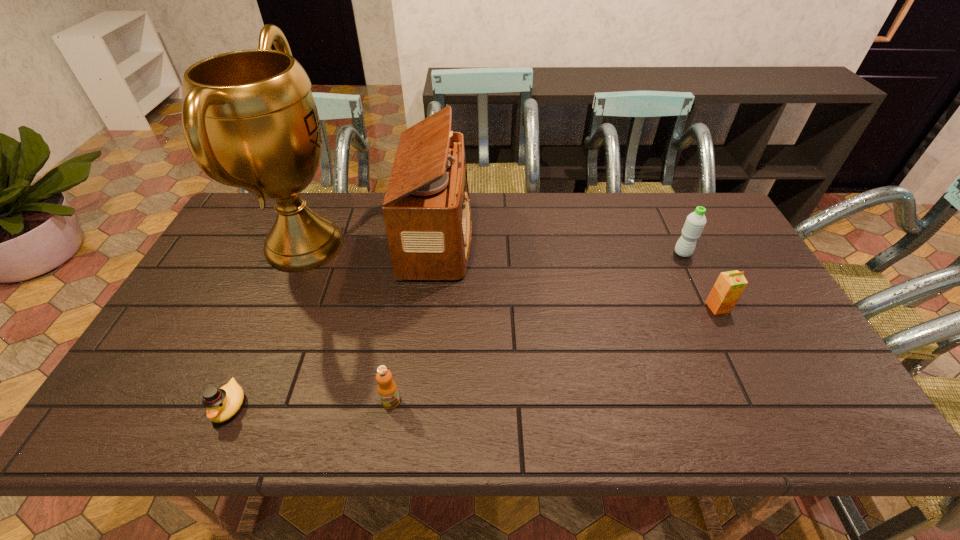
In order to click on vacant area that satisfies the following two spatial constraints: 1. on the back side of the water bottle; 2. on the front panel of the radio receiver in this screenshot , I will do `click(675, 237)`.

Locate an element on the screen. Image resolution: width=960 pixels, height=540 pixels. free space that satisfies the following two spatial constraints: 1. on the front panel of the radio receiver; 2. on the left side of the right orange juice is located at coordinates (430, 307).

Locate an element on the screen. vacant position in the image that satisfies the following two spatial constraints: 1. on the surface of the tallest object with symbols; 2. on the right side of the farther orange juice is located at coordinates (278, 307).

Find the location of a particular element. This screenshot has width=960, height=540. free point that satisfies the following two spatial constraints: 1. on the front panel of the second tallest object; 2. on the right side of the water bottle is located at coordinates (436, 253).